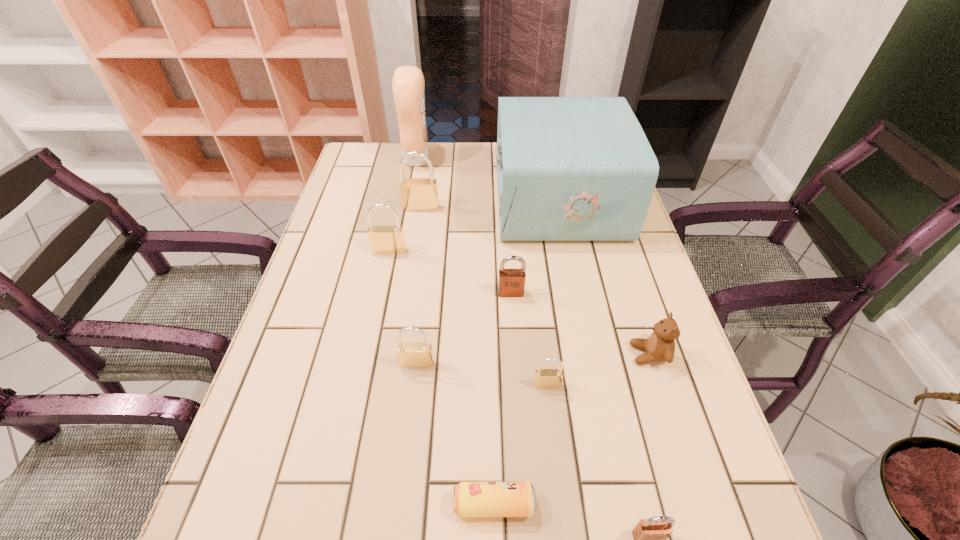
In order to click on free spot between the second padlock from right to left and the bigger brown padlock in this screenshot , I will do 529,339.

At what (x,y) coordinates should I click in order to perform the action: click on free space between the radio receiver and the third nearest brass padlock. Please return your answer as a coordinate pair (x, y). The height and width of the screenshot is (540, 960). Looking at the image, I should click on (473, 226).

This screenshot has width=960, height=540. I want to click on empty location between the farthest brass padlock and the bigger brown padlock, so click(x=466, y=251).

Find the location of `blank region between the biggest brass padlock and the radio receiver`. blank region between the biggest brass padlock and the radio receiver is located at coordinates (490, 204).

The image size is (960, 540). In order to click on free space between the teddy bear and the fourth farthest padlock in this screenshot , I will do `click(533, 359)`.

Point out which object is positioned as the second nearest to the smallest brass padlock. Please provide its 2D coordinates. Your answer should be formatted as a tuple, i.e. [(x, y)], where the tuple contains the x and y coordinates of a point satisfying the conditions above.

[(471, 499)]

Locate which object ranks fifth in proximity to the second nearest object. Please provide its 2D coordinates. Your answer should be formatted as a tuple, i.e. [(x, y)], where the tuple contains the x and y coordinates of a point satisfying the conditions above.

[(511, 283)]

Identify the location of padlock that is the closest to the ninth farthest object. The image size is (960, 540). coord(649,535).

Where is `padlock that is the fifth closest to the nearest brass padlock`? padlock that is the fifth closest to the nearest brass padlock is located at coordinates (416, 194).

This screenshot has width=960, height=540. Find the location of `brass padlock that is the fourth closest one to the nearest padlock`. brass padlock that is the fourth closest one to the nearest padlock is located at coordinates point(416,194).